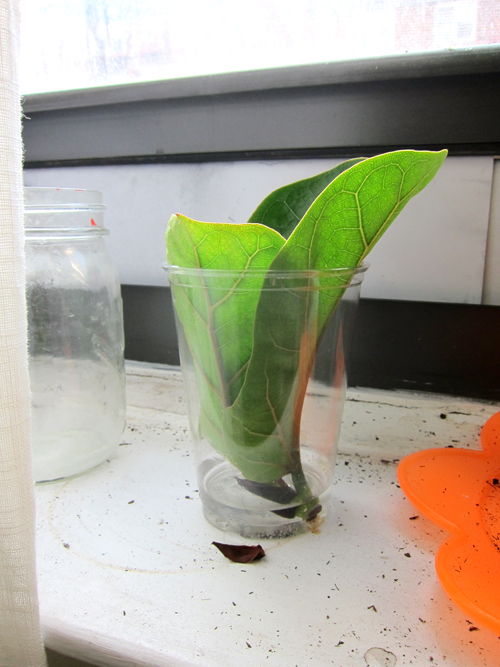
Find the location of a particular element. This screenshot has width=500, height=667. white counter is located at coordinates (386, 595).